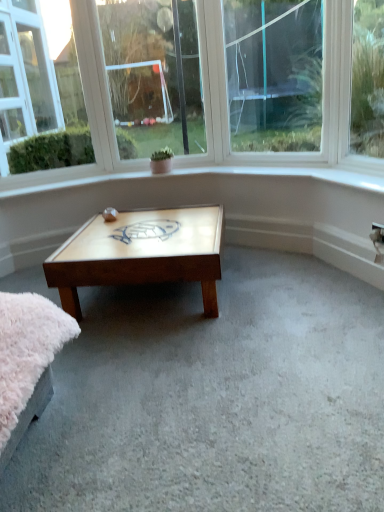
Question: Can you confirm if wooden turtle at center is smaller than clear glass window at upper center, which is the second window in left-to-right order?

Choices:
 (A) no
 (B) yes

Answer: (B)

Question: From the image's perspective, is wooden turtle at center located beneath clear glass window at upper center, positioned as the second window in right-to-left order?

Choices:
 (A) no
 (B) yes

Answer: (B)

Question: Is wooden turtle at center wider than clear glass window at upper center, which is the second window in left-to-right order?

Choices:
 (A) yes
 (B) no

Answer: (A)

Question: From a real-world perspective, is wooden turtle at center on top of clear glass window at upper center, positioned as the second window in right-to-left order?

Choices:
 (A) yes
 (B) no

Answer: (B)

Question: Considering the relative sizes of wooden turtle at center and clear glass window at upper center, positioned as the second window in right-to-left order, in the image provided, is wooden turtle at center bigger than clear glass window at upper center, positioned as the second window in right-to-left order,?

Choices:
 (A) yes
 (B) no

Answer: (B)

Question: In the image, is clear glass window at upper center, the third window when ordered from left to right, on the left side or the right side of wooden turtle at center?

Choices:
 (A) left
 (B) right

Answer: (B)

Question: Is point (233, 103) closer or farther from the camera than point (109, 206)?

Choices:
 (A) farther
 (B) closer

Answer: (B)

Question: From their relative heights in the image, would you say clear glass window at upper center, the third window when ordered from left to right, is taller or shorter than wooden turtle at center?

Choices:
 (A) short
 (B) tall

Answer: (B)

Question: Do you think clear glass window at upper center, the third window when ordered from left to right, is within wooden turtle at center, or outside of it?

Choices:
 (A) inside
 (B) outside

Answer: (B)

Question: In the image, is wooden turtle design at center positioned in front of or behind clear glass window at upper left, the 1th window when ordered from left to right?

Choices:
 (A) behind
 (B) front

Answer: (B)

Question: In terms of height, does wooden turtle design at center look taller or shorter compared to clear glass window at upper left, placed as the 3th window when sorted from right to left?

Choices:
 (A) short
 (B) tall

Answer: (A)

Question: From a real-world perspective, is wooden turtle design at center positioned above or below clear glass window at upper left, placed as the 3th window when sorted from right to left?

Choices:
 (A) above
 (B) below

Answer: (B)

Question: Does point (97, 237) appear closer or farther from the camera than point (49, 101)?

Choices:
 (A) farther
 (B) closer

Answer: (B)

Question: Based on their sizes in the image, would you say clear glass window at upper center, positioned as the second window in right-to-left order, is bigger or smaller than wooden turtle design at center?

Choices:
 (A) small
 (B) big

Answer: (A)

Question: From a real-world perspective, is clear glass window at upper center, positioned as the second window in right-to-left order, above or below wooden turtle design at center?

Choices:
 (A) below
 (B) above

Answer: (B)